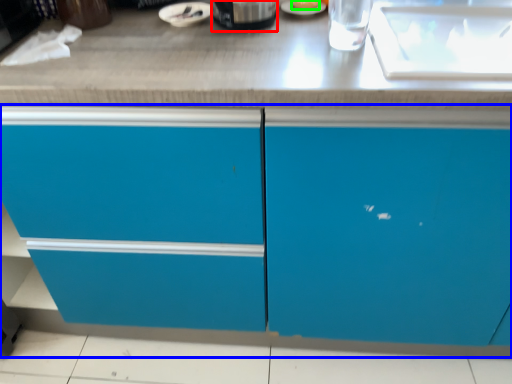
Question: Considering the real-world distances, which object is closest to appliance (highlighted by a red box)? cabinetry (highlighted by a blue box) or food (highlighted by a green box).

Choices:
 (A) cabinetry
 (B) food

Answer: (B)